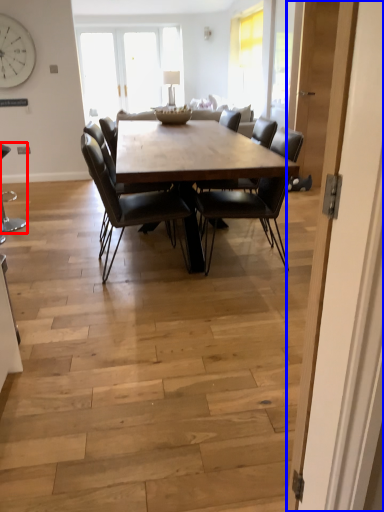
Question: Which object appears closest to the camera in this image, chair (highlighted by a red box) or door (highlighted by a blue box)?

Choices:
 (A) chair
 (B) door

Answer: (B)